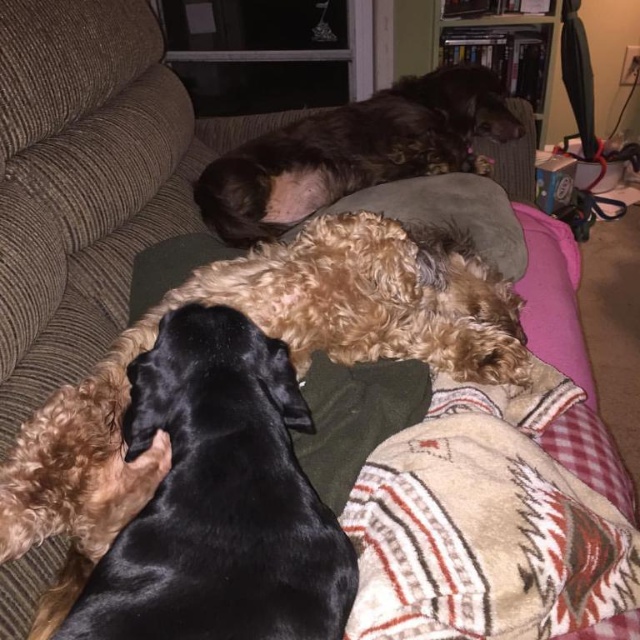
Can you confirm if plaid fleece blanket at lower right is taller than shiny brown fur at upper center?

In fact, plaid fleece blanket at lower right may be shorter than shiny brown fur at upper center.

Locate an element on the screen. plaid fleece blanket at lower right is located at coordinates (490, 520).

Locate an element on the screen. Image resolution: width=640 pixels, height=640 pixels. plaid fleece blanket at lower right is located at coordinates (490, 520).

At what (x,y) coordinates should I click in order to perform the action: click on plaid fleece blanket at lower right. Please return your answer as a coordinate pair (x, y). Looking at the image, I should click on click(490, 520).

What do you see at coordinates (220, 499) in the screenshot? I see `black silky dog at center` at bounding box center [220, 499].

Between black silky dog at center and shiny brown fur at upper center, which one appears on the right side from the viewer's perspective?

Positioned to the right is shiny brown fur at upper center.

Who is more distant from viewer, (157,381) or (300,132)?

Positioned behind is point (300,132).

Where is `black silky dog at center`? black silky dog at center is located at coordinates (x=220, y=499).

Does black silky dog at center have a lesser height compared to plaid fleece blanket at lower right?

Incorrect, black silky dog at center's height does not fall short of plaid fleece blanket at lower right's.

Does black silky dog at center have a lesser width compared to plaid fleece blanket at lower right?

Yes.

Measure the distance between point (266, 548) and camera.

The distance of point (266, 548) from camera is 23.01 inches.

At what (x,y) coordinates should I click in order to perform the action: click on black silky dog at center. Please return your answer as a coordinate pair (x, y). Looking at the image, I should click on (220, 499).